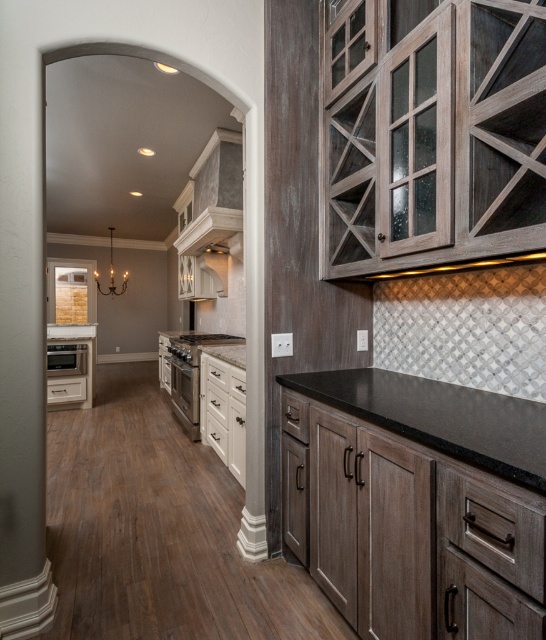
Question: Can you confirm if dark brown wood cabinet at right is positioned to the right of satin stainless steel oven at left?

Choices:
 (A) yes
 (B) no

Answer: (A)

Question: Where is distressed wood cabinet at upper right located in relation to satin nickel oven at center in the image?

Choices:
 (A) left
 (B) right

Answer: (B)

Question: Which object appears farthest from the camera in this image?

Choices:
 (A) satin nickel oven at center
 (B) black granite countertop at center
 (C) distressed wood cabinet at upper right
 (D) dark brown wood cabinet at right

Answer: (A)

Question: Is distressed wood cabinet at upper right to the left of white glossy cabinet at center from the viewer's perspective?

Choices:
 (A) yes
 (B) no

Answer: (B)

Question: Estimate the real-world distances between objects in this image. Which object is farther from the dark brown wood cabinet at right?

Choices:
 (A) white glossy cabinet at center
 (B) satin nickel oven at center
 (C) distressed wood cabinet at upper right
 (D) matte glass exhaust hood at center

Answer: (D)

Question: Which of the following is the closest to the observer?

Choices:
 (A) matte glass exhaust hood at center
 (B) satin nickel oven at center
 (C) distressed wood cabinet at upper right

Answer: (C)